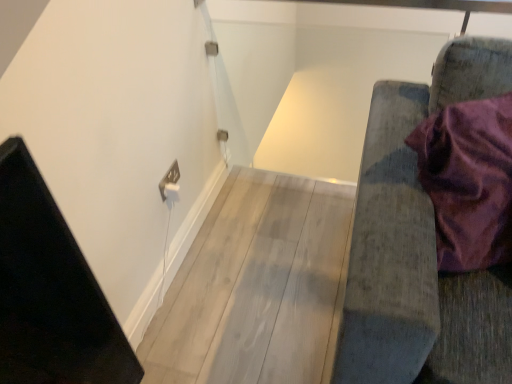
Identify the location of velvet purple cushion at right. The height and width of the screenshot is (384, 512). (420, 245).

What do you see at coordinates (420, 245) in the screenshot? This screenshot has height=384, width=512. I see `velvet purple cushion at right` at bounding box center [420, 245].

Find the location of `white plastic electric outlet at upper left`. white plastic electric outlet at upper left is located at coordinates (170, 180).

What is the approximate height of white plastic electric outlet at upper left?

It is 9.61 centimeters.

What is the approximate width of white plastic electric outlet at upper left?

1.03 centimeters.

The image size is (512, 384). What do you see at coordinates (170, 180) in the screenshot?
I see `white plastic electric outlet at upper left` at bounding box center [170, 180].

Find the location of a particular element. velvet purple cushion at right is located at coordinates (420, 245).

Can you confirm if velvet purple cushion at right is positioned to the left of white plastic electric outlet at upper left?

No, velvet purple cushion at right is not to the left of white plastic electric outlet at upper left.

Is velvet purple cushion at right positioned in front of white plastic electric outlet at upper left?

Yes, velvet purple cushion at right is closer to the camera.

Considering the points (438, 327) and (170, 181), which point is behind, point (438, 327) or point (170, 181)?

Point (170, 181)

From the image's perspective, which one is positioned lower, velvet purple cushion at right or white plastic electric outlet at upper left?

velvet purple cushion at right.

From a real-world perspective, is velvet purple cushion at right positioned under white plastic electric outlet at upper left based on gravity?

No, from a real-world perspective, velvet purple cushion at right is not beneath white plastic electric outlet at upper left.

Can you confirm if velvet purple cushion at right is wider than white plastic electric outlet at upper left?

Correct, the width of velvet purple cushion at right exceeds that of white plastic electric outlet at upper left.

Who is shorter, velvet purple cushion at right or white plastic electric outlet at upper left?

Standing shorter between the two is white plastic electric outlet at upper left.

Considering the relative sizes of velvet purple cushion at right and white plastic electric outlet at upper left in the image provided, is velvet purple cushion at right smaller than white plastic electric outlet at upper left?

No, velvet purple cushion at right is not smaller than white plastic electric outlet at upper left.

Which is correct: velvet purple cushion at right is inside white plastic electric outlet at upper left, or outside of it?

velvet purple cushion at right is spatially situated outside white plastic electric outlet at upper left.

Is there a large distance between velvet purple cushion at right and white plastic electric outlet at upper left?

No, velvet purple cushion at right is not far from white plastic electric outlet at upper left.

Could you tell me if velvet purple cushion at right is turned towards white plastic electric outlet at upper left?

No, velvet purple cushion at right is not facing towards white plastic electric outlet at upper left.

Can you tell me how much velvet purple cushion at right and white plastic electric outlet at upper left differ in facing direction?

88.2 degrees.

The image size is (512, 384). I want to click on electric outlet behind the velvet purple cushion at right, so click(170, 180).

Between white plastic electric outlet at upper left and velvet purple cushion at right, which one appears on the left side from the viewer's perspective?

Positioned to the left is white plastic electric outlet at upper left.

From the picture: Considering the positions of objects white plastic electric outlet at upper left and velvet purple cushion at right in the image provided, who is in front, white plastic electric outlet at upper left or velvet purple cushion at right?

velvet purple cushion at right is closer to the camera.

Is point (170, 175) behind point (482, 277)?

Yes.

From the image's perspective, between white plastic electric outlet at upper left and velvet purple cushion at right, who is located below?

velvet purple cushion at right.

From a real-world perspective, which object rests below the other?

white plastic electric outlet at upper left, from a real-world perspective.

Considering the sizes of white plastic electric outlet at upper left and velvet purple cushion at right in the image, is white plastic electric outlet at upper left wider or thinner than velvet purple cushion at right?

white plastic electric outlet at upper left is thinner than velvet purple cushion at right.

Considering the sizes of white plastic electric outlet at upper left and velvet purple cushion at right in the image, is white plastic electric outlet at upper left taller or shorter than velvet purple cushion at right?

Considering their sizes, white plastic electric outlet at upper left has less height than velvet purple cushion at right.

Which of these two, white plastic electric outlet at upper left or velvet purple cushion at right, is bigger?

With larger size is velvet purple cushion at right.

Can velvet purple cushion at right be found inside white plastic electric outlet at upper left?

Definitely not — velvet purple cushion at right is not inside white plastic electric outlet at upper left.

Is white plastic electric outlet at upper left with velvet purple cushion at right?

There is a gap between white plastic electric outlet at upper left and velvet purple cushion at right.

Is white plastic electric outlet at upper left facing away from velvet purple cushion at right?

white plastic electric outlet at upper left does not have its back to velvet purple cushion at right.

Based on the photo, what's the angular difference between white plastic electric outlet at upper left and velvet purple cushion at right's facing directions?

There is a 88.2-degree angle between the facing directions of white plastic electric outlet at upper left and velvet purple cushion at right.

Find the location of a particular element. The height and width of the screenshot is (384, 512). electric outlet behind the velvet purple cushion at right is located at coordinates (x=170, y=180).

Identify the location of furniture above the white plastic electric outlet at upper left (from a real-world perspective). (420, 245).

This screenshot has width=512, height=384. I want to click on furniture in front of the white plastic electric outlet at upper left, so pos(420,245).